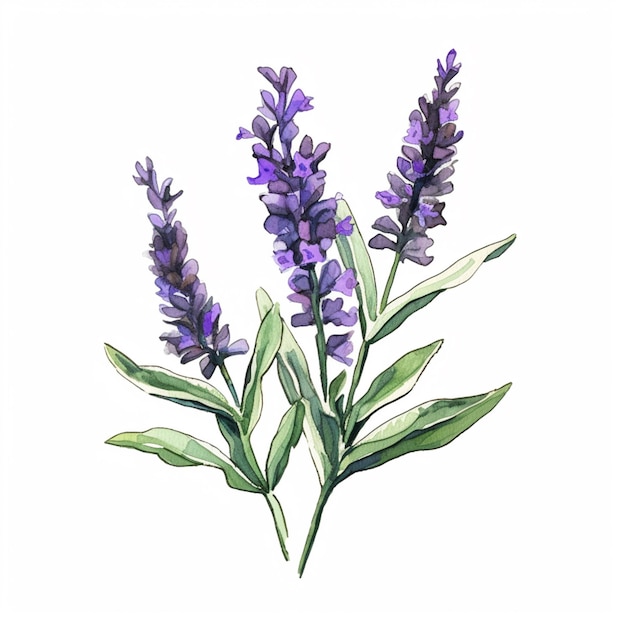
Where is `center plant`? center plant is located at coordinates (315, 304).